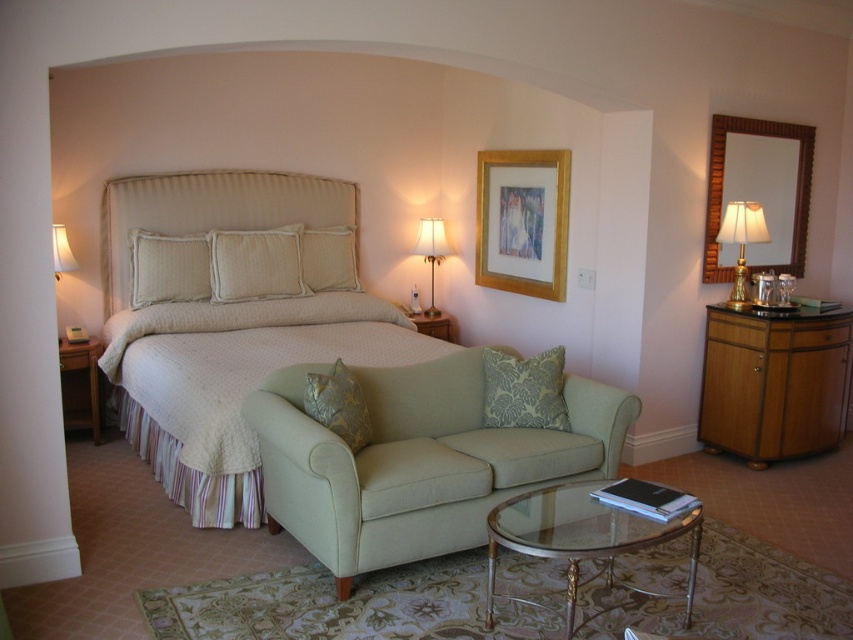
You are standing in the bedroom and want to place a small vase between the light beige fabric pillow at center and the matte gold lamp at upper center. Can you tell me which object you should place the vase closer to in order to keep it near the front of the scene?

The light beige fabric pillow at center is closer to the viewer than the matte gold lamp at upper center, so place the vase closer to the light beige fabric pillow at center to keep it near the front of the scene.

You are arranging flowers in the bedroom and want to place a vase on the highest available surface near the light beige fabric pillow at center and the matte gold lamp at upper center. Which object should you choose?

The light beige fabric pillow at center is above the matte gold lamp at upper center, so you should place the vase on the light beige fabric pillow at center since it is higher.

You are trying to place a beige fabric pillow at center onto the beige quilted bed at center. Can you determine if the pillow will fit on the bed?

The beige quilted bed at center might be wider than beige fabric pillow at center, so the pillow should fit on the bed as long as its dimensions are within the bedspread.